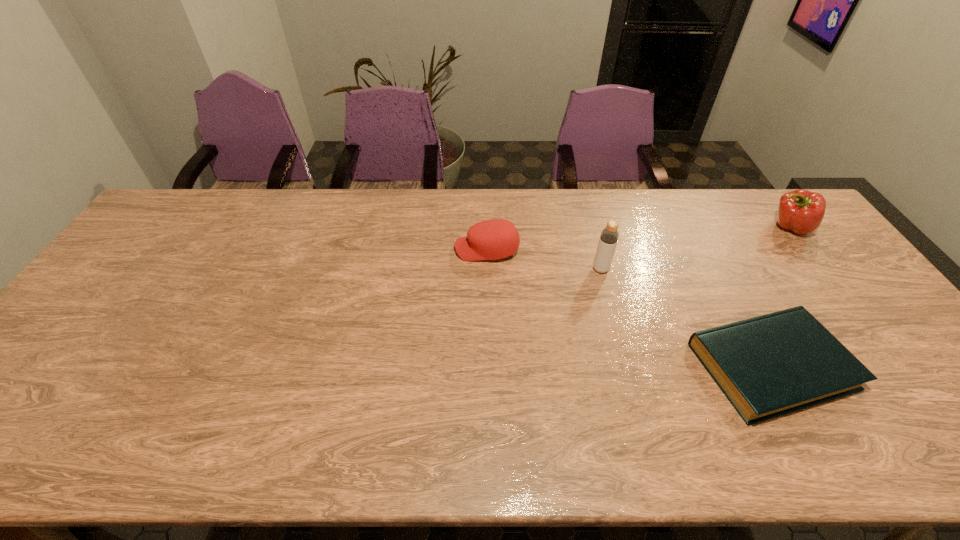
Image resolution: width=960 pixels, height=540 pixels. Find the location of `bottle`. bottle is located at coordinates click(609, 236).

Locate an element on the screen. the third object from right to left is located at coordinates (609, 236).

Locate an element on the screen. The image size is (960, 540). pepper is located at coordinates (801, 211).

You are a GUI agent. You are given a task and a screenshot of the screen. Output one action in this format:
    pyautogui.click(x=<x>, y=<y>)
    Task: Click on the third shortest object
    
    Given the screenshot: What is the action you would take?
    pos(801,211)

This screenshot has width=960, height=540. I want to click on cap, so click(x=494, y=239).

Identify the location of the leftmost object. (494, 239).

You are a GUI agent. You are given a task and a screenshot of the screen. Output one action in this format:
    pyautogui.click(x=<x>, y=<y>)
    Task: Click on the nearest object
    The height and width of the screenshot is (540, 960).
    Given the screenshot: What is the action you would take?
    pyautogui.click(x=767, y=366)

Where is `the shortest object`? the shortest object is located at coordinates (767, 366).

Locate an element on the screen. The image size is (960, 540). vacant area situated 0.220m on the left of the tallest object is located at coordinates (519, 269).

Where is `free space located 0.350m on the left of the rightmost object`? free space located 0.350m on the left of the rightmost object is located at coordinates (661, 227).